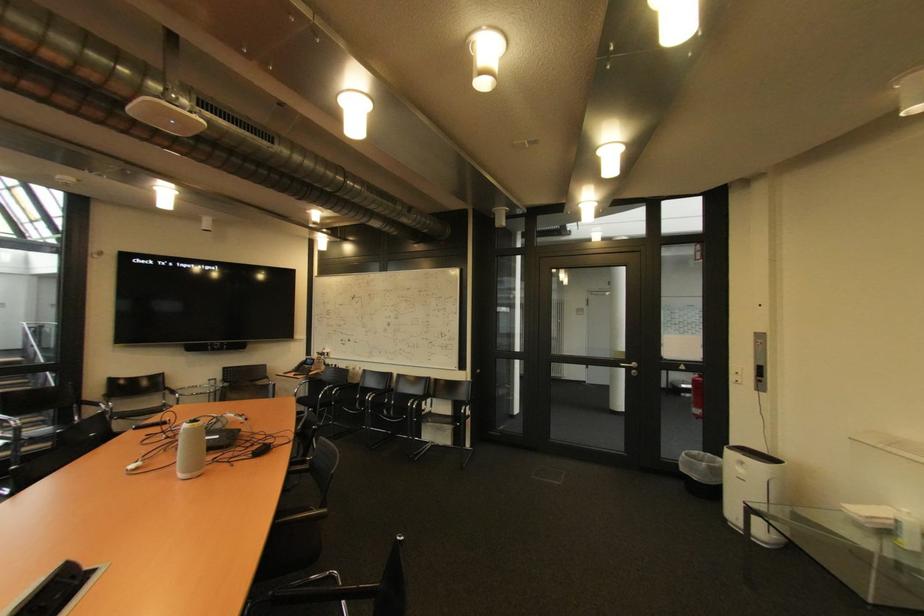
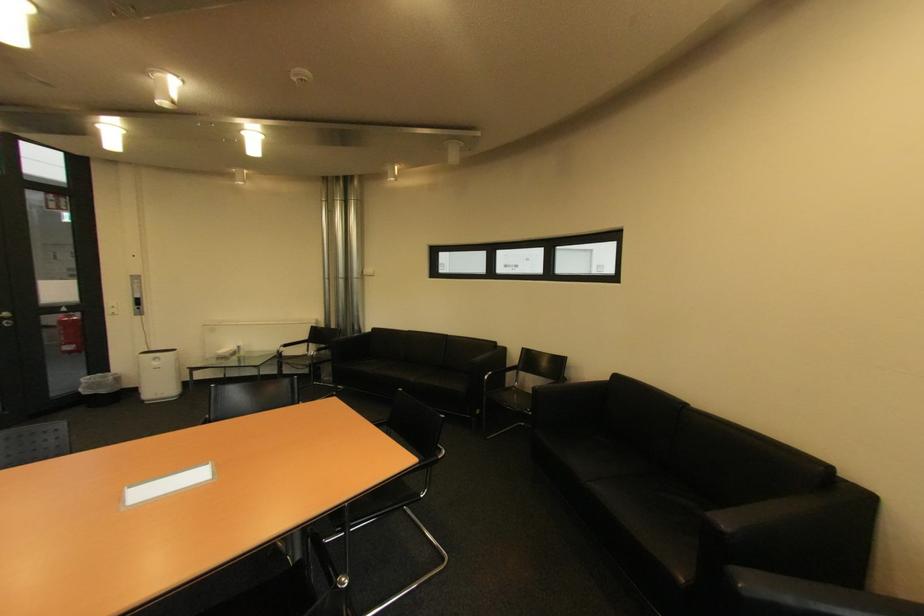
Locate, in the second image, the point that corresponds to pixel 748 471 in the first image.

(164, 363)